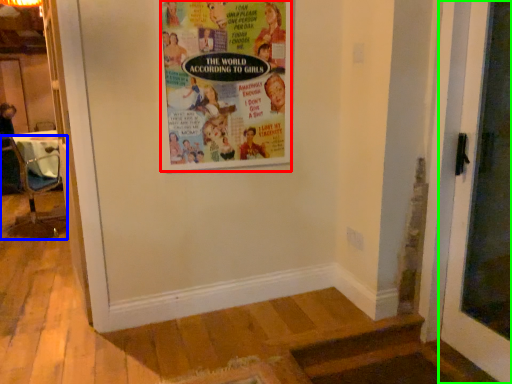
Question: Considering the real-world distances, which object is closest to poster (highlighted by a red box)? chair (highlighted by a blue box) or door (highlighted by a green box).

Choices:
 (A) chair
 (B) door

Answer: (B)